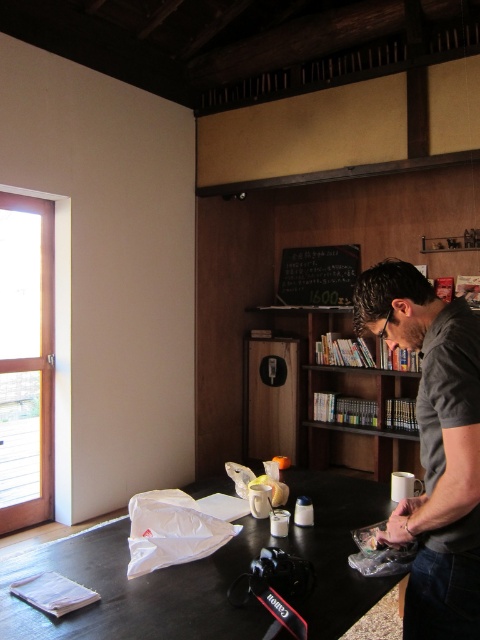
You are standing in the room and want to reach the point at coordinates (424,608). If your height is 1.7 meters, will you be able to touch the ceiling at that point?

The distance between you and the point at coordinates (424,608) is 1.34 meters. Since your height is 1.7 meters, which is greater than the distance to the point, you can reach the ceiling at that point.

Based on the photo, you are a customer in the cafe and want to take a photo of the dark gray shirt at center and the black chalkboard at upper center. Which one is closer to the camera?

The dark gray shirt at center is taller than the black chalkboard at upper center, so it is closer to the camera.

You are organizing items on a dark wooden table in a cozy indoor setting. You need to place a new item between the white paper at center and the dark gray shirt at center. Based on their current positions, where should you place the new item?

The white paper at center is to the left of the dark gray shirt at center, so you should place the new item between them to the right of the white paper at center and to the left of the dark gray shirt at center.